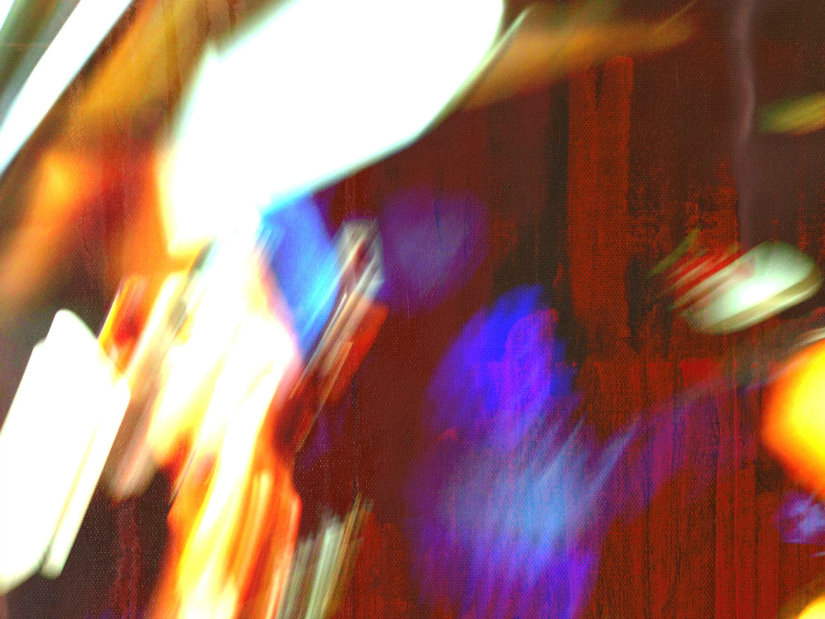
Find the location of a particular element. white light is located at coordinates (364, 119), (26, 439).